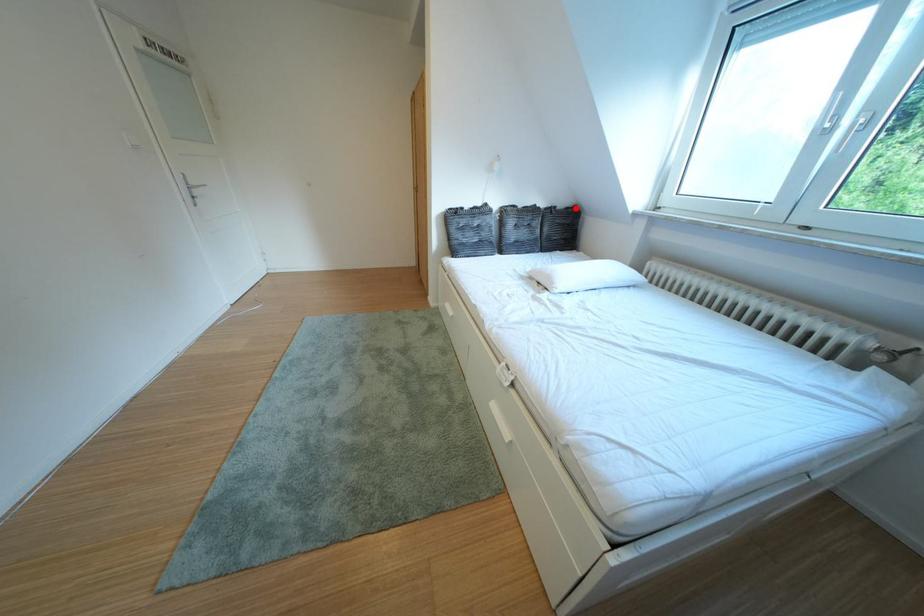
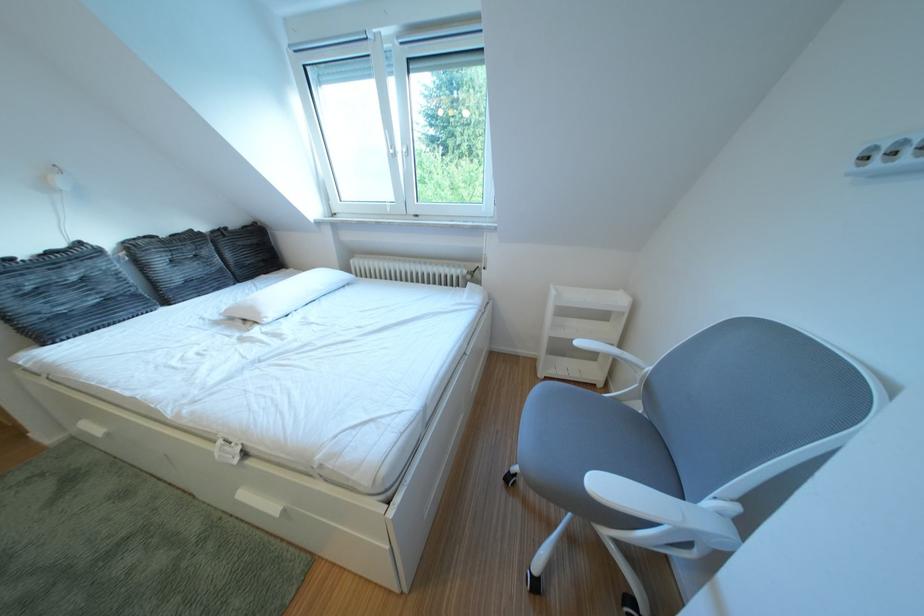
Find the pixel in the second image that matches the highlighted location in the first image.

(247, 228)